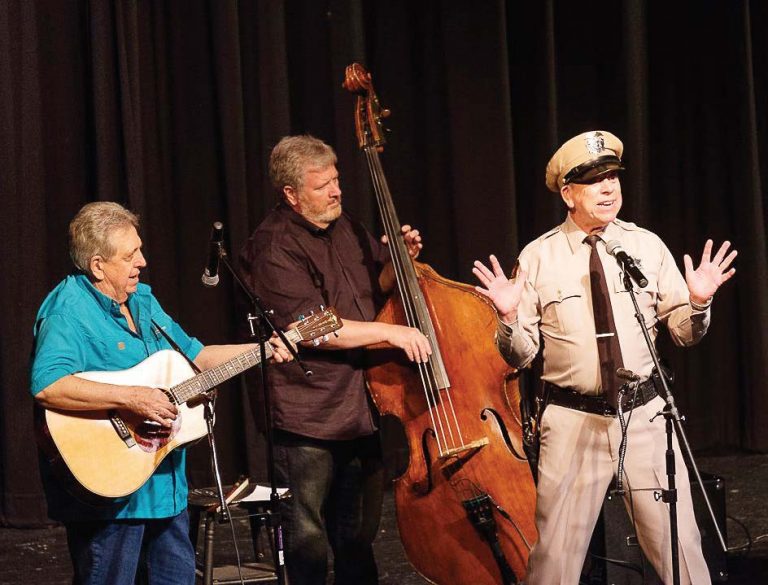
Where is `stand`? stand is located at coordinates (269, 441).